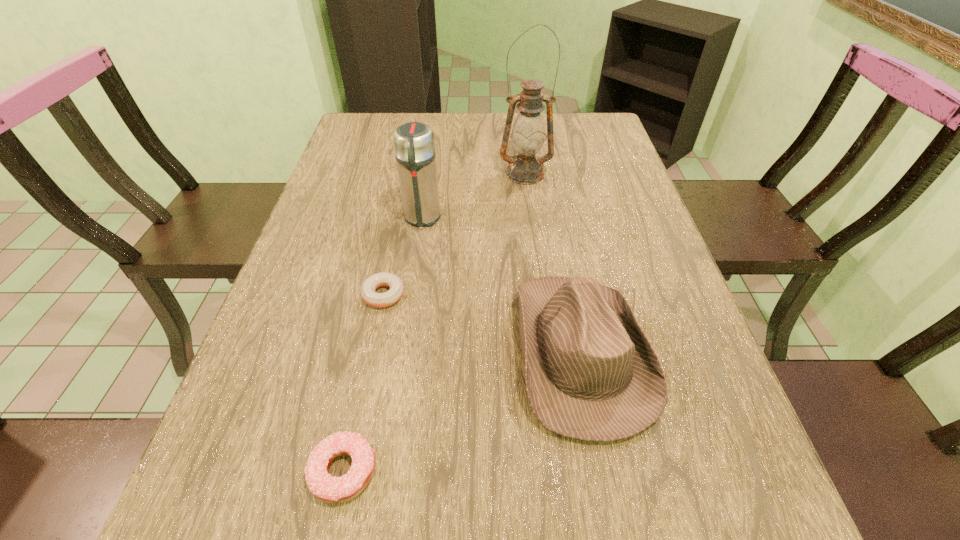
Locate which object is the closest to the shorter doughnut. Please provide its 2D coordinates. Your answer should be formatted as a tuple, i.e. [(x, y)], where the tuple contains the x and y coordinates of a point satisfying the conditions above.

[(414, 145)]

Where is `vacant space that satisfies the following two spatial constraints: 1. on the front side of the third shortest object; 2. on the right side of the farthest object`? vacant space that satisfies the following two spatial constraints: 1. on the front side of the third shortest object; 2. on the right side of the farthest object is located at coordinates (548, 351).